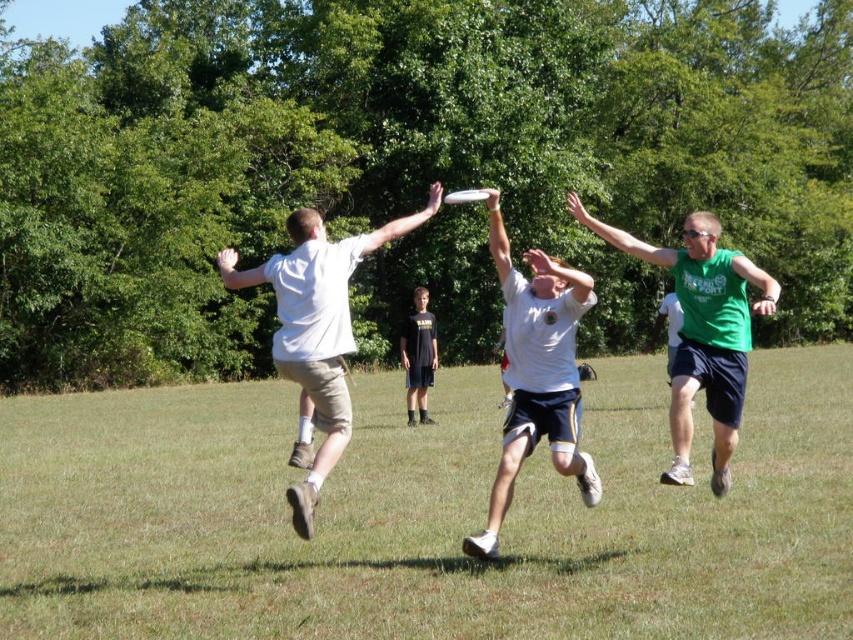
Is green grass at center above white matte shirt at center?

No.

Who is more distant from viewer, [842,529] or [566,292]?

Point [842,529]

This screenshot has width=853, height=640. What do you see at coordinates (425, 516) in the screenshot? I see `green grass at center` at bounding box center [425, 516].

In order to click on green grass at center in this screenshot , I will do `click(425, 516)`.

Does green sleeveless shirt at right have a greater width compared to dark gray shorts at center?

Indeed, green sleeveless shirt at right has a greater width compared to dark gray shorts at center.

Between point (692, 294) and point (422, 333), which one is positioned behind?

Point (422, 333)

Find the location of `green sleeveless shirt at right`. green sleeveless shirt at right is located at coordinates (701, 332).

Locate an element on the screen. Image resolution: width=853 pixels, height=640 pixels. green sleeveless shirt at right is located at coordinates (701, 332).

Between white cotton shirt at center and dark gray shorts at center, which one appears on the left side from the viewer's perspective?

white cotton shirt at center

Does white cotton shirt at center appear under dark gray shorts at center?

No.

Image resolution: width=853 pixels, height=640 pixels. Identify the location of white cotton shirt at center. (317, 326).

This screenshot has width=853, height=640. I want to click on white cotton shirt at center, so click(x=317, y=326).